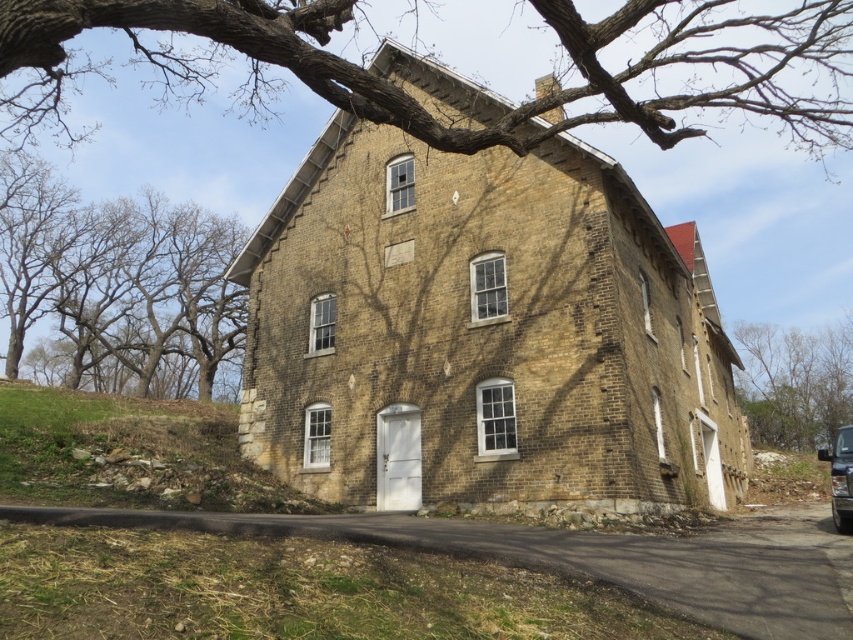
You are standing in front of the two story brick building and notice the bare branches at left and the bare branches at right. Which of these two has a wider spread?

The bare branches at left has a wider spread than the bare branches at right.

Based on the photo, you are standing in front of the two story brick building and want to take a photo of both the brown bark tree at upper center and the metallic silver car at lower right. Which object will appear wider in the photo?

The brown bark tree at upper center will appear wider in the photo because its width surpasses that of the metallic silver car at lower right.